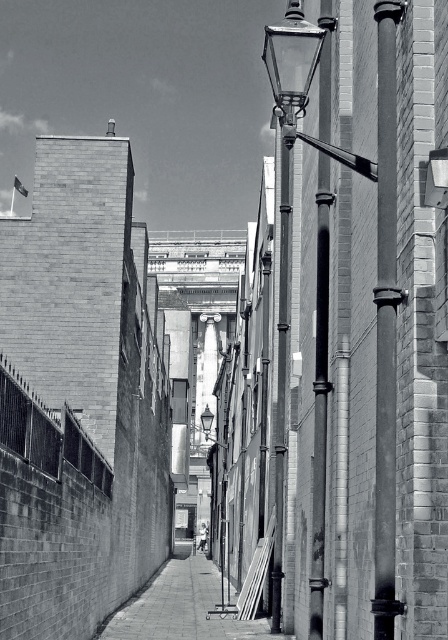
Between smooth metal pole at center right and smooth concrete pavement at center, which one is positioned higher?

smooth metal pole at center right

Can you confirm if smooth metal pole at center right is smaller than smooth concrete pavement at center?

Indeed, smooth metal pole at center right has a smaller size compared to smooth concrete pavement at center.

Where is `smooth metal pole at center right`? smooth metal pole at center right is located at coordinates (386, 321).

Who is taller, smooth concrete pavement at center or smooth metal pole at center?

With more height is smooth metal pole at center.

Consider the image. Is smooth concrete pavement at center below smooth metal pole at center?

Correct, smooth concrete pavement at center is located below smooth metal pole at center.

This screenshot has width=448, height=640. I want to click on smooth concrete pavement at center, so click(181, 608).

Can you confirm if smooth metal pole at center right is positioned above smooth metal pole at center?

No, smooth metal pole at center right is not above smooth metal pole at center.

Is smooth metal pole at center right positioned in front of smooth metal pole at center?

Yes, smooth metal pole at center right is closer to the viewer.

Between point (387, 365) and point (284, 184), which one is positioned in front?

Positioned in front is point (387, 365).

This screenshot has width=448, height=640. I want to click on smooth metal pole at center right, so click(x=386, y=321).